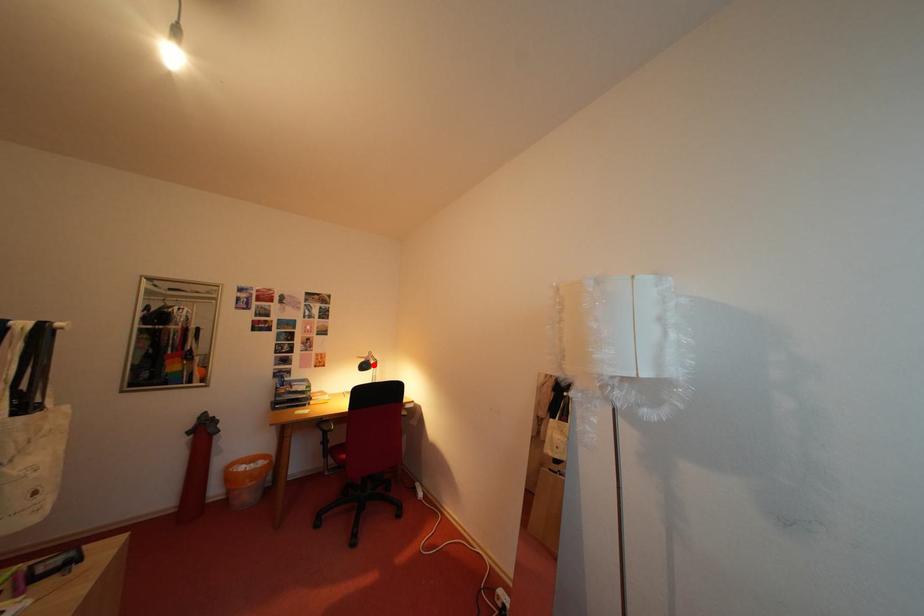
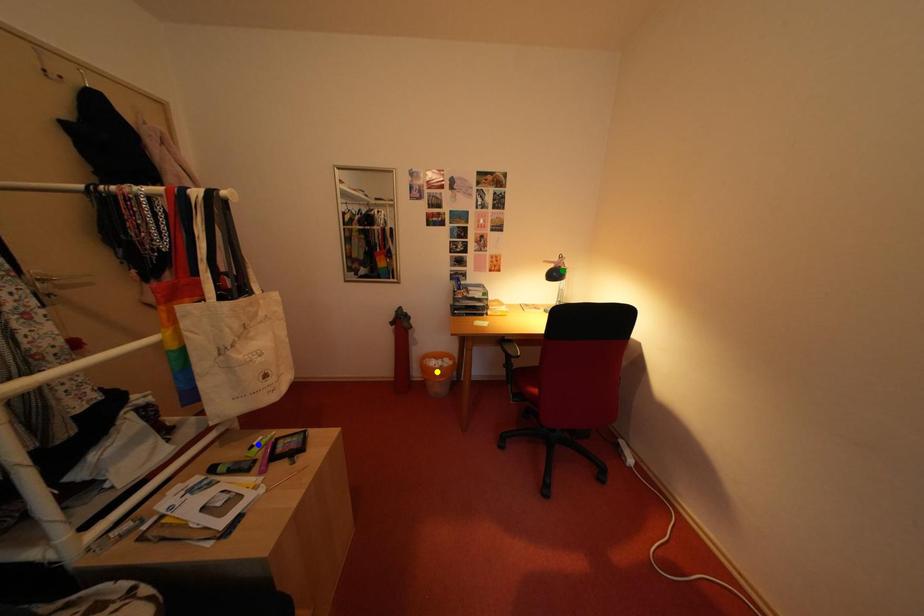
Question: I am providing you with two images of the same scene from different viewpoints. A red point is marked on the first image. You are given multiple points on the second image. Which spot in image 2 lines up with the point in image 1?

Choices:
 (A) blue point
 (B) yellow point
 (C) green point

Answer: (C)